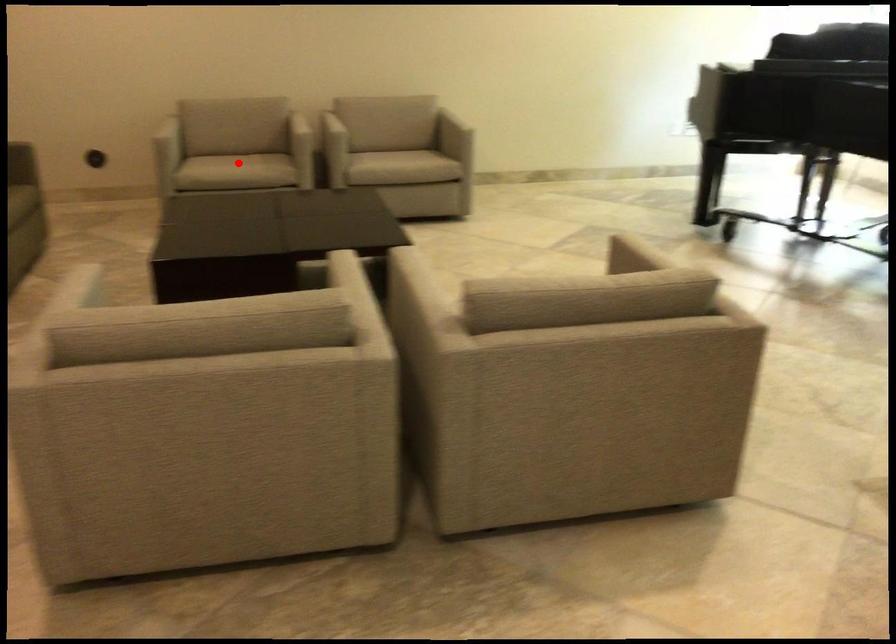
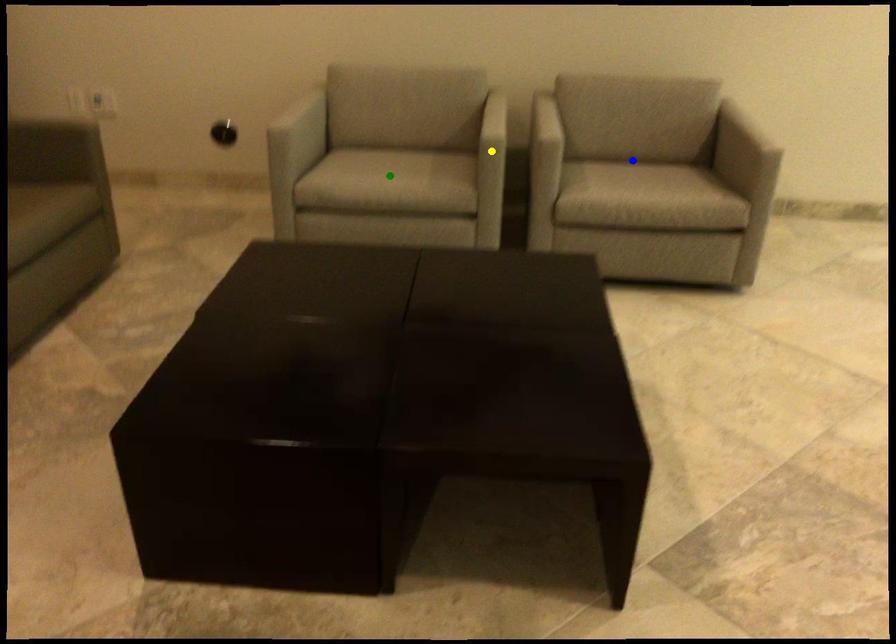
Question: I am providing you with two images of the same scene from different viewpoints. A red point is marked on the first image. You are given multiple points on the second image. In image 2, which mark is for the same physical point as the one in image 1?

Choices:
 (A) blue point
 (B) yellow point
 (C) green point

Answer: (C)